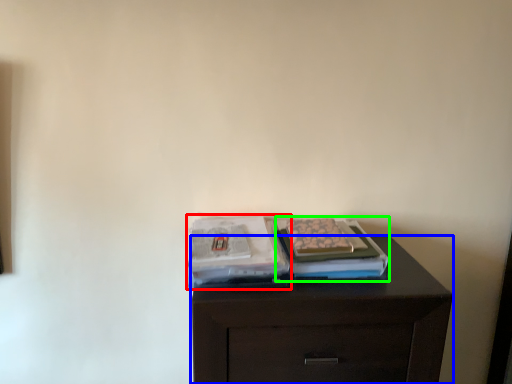
Question: Based on their relative distances, which object is farther from magazine (highlighted by a red box)? Choose from chest of drawers (highlighted by a blue box) and magazine (highlighted by a green box).

Choices:
 (A) chest of drawers
 (B) magazine

Answer: (A)